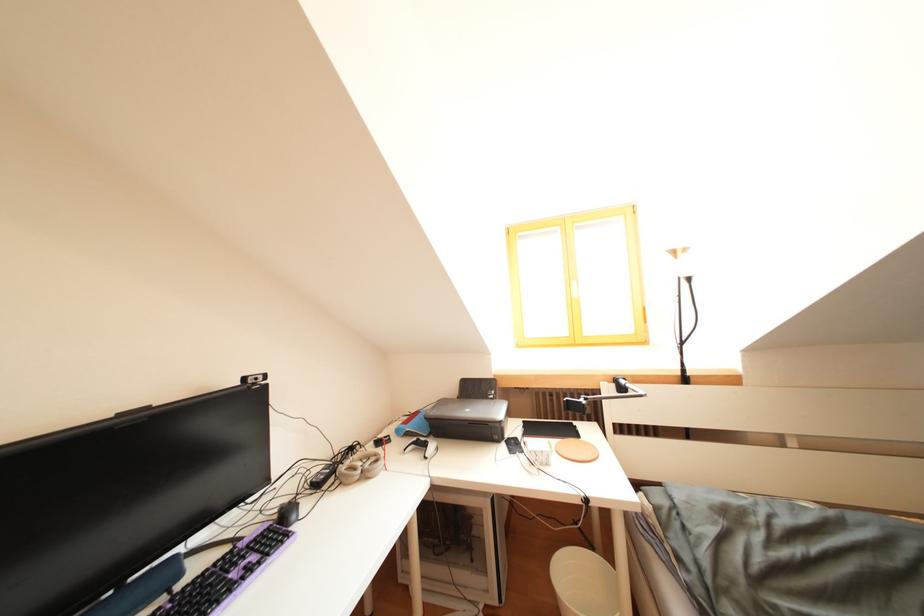
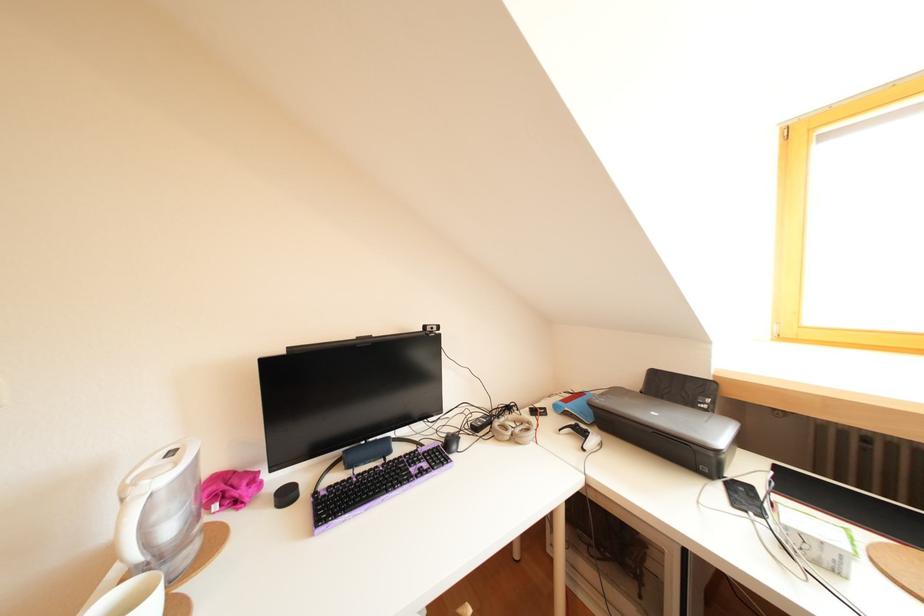
Find the pixel in the second image that matches point 442,418 in the first image.

(610, 407)